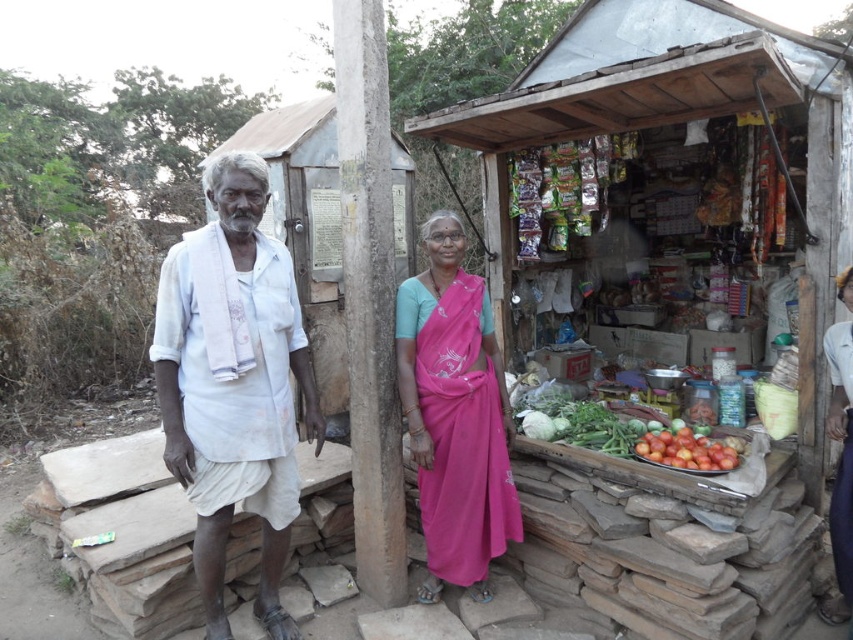
Which is more to the right, white cotton shirt at left or shiny red tomatoes at center?

Positioned to the right is shiny red tomatoes at center.

Locate an element on the screen. white cotton shirt at left is located at coordinates (233, 384).

Identify the location of white cotton shirt at left. Image resolution: width=853 pixels, height=640 pixels. (233, 384).

Can you confirm if white cotton shirt at left is positioned to the left of white cotton shirt at center?

Indeed, white cotton shirt at left is positioned on the left side of white cotton shirt at center.

Can you confirm if white cotton shirt at left is taller than white cotton shirt at center?

Correct, white cotton shirt at left is much taller as white cotton shirt at center.

Find the location of a particular element. white cotton shirt at left is located at coordinates (233, 384).

Between white cotton shirt at center and pink silk saree at center, which one has more height?

white cotton shirt at center

Can you confirm if white cotton shirt at center is positioned to the left of pink silk saree at center?

Indeed, white cotton shirt at center is positioned on the left side of pink silk saree at center.

Measure the distance between point (286,621) and camera.

A distance of 3.15 meters exists between point (286,621) and camera.

Image resolution: width=853 pixels, height=640 pixels. Identify the location of white cotton shirt at center. (233, 384).